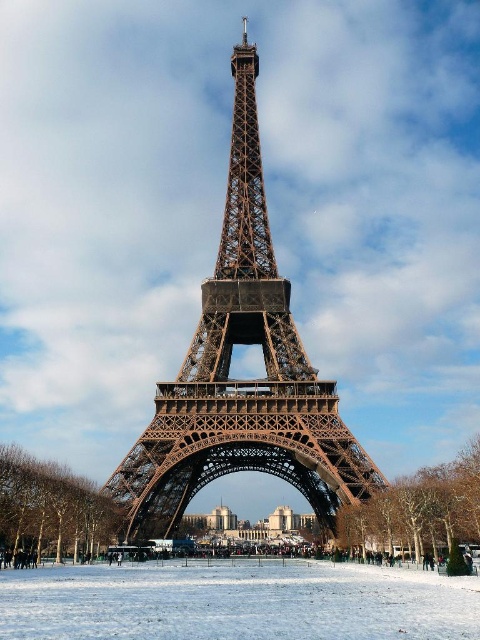
Question: Which point is farther to the camera?

Choices:
 (A) (183, 618)
 (B) (132, 509)

Answer: (B)

Question: Which object appears farthest from the camera in this image?

Choices:
 (A) brown metallic eiffel tower at center
 (B) white powdery snow at center

Answer: (A)

Question: Does brown metallic eiffel tower at center have a greater width compared to white powdery snow at center?

Choices:
 (A) yes
 (B) no

Answer: (B)

Question: Among these objects, which one is farthest from the camera?

Choices:
 (A) white powdery snow at center
 (B) brown metallic eiffel tower at center

Answer: (B)

Question: Does brown metallic eiffel tower at center appear on the right side of white powdery snow at center?

Choices:
 (A) no
 (B) yes

Answer: (B)

Question: Is brown metallic eiffel tower at center further to camera compared to white powdery snow at center?

Choices:
 (A) no
 (B) yes

Answer: (B)